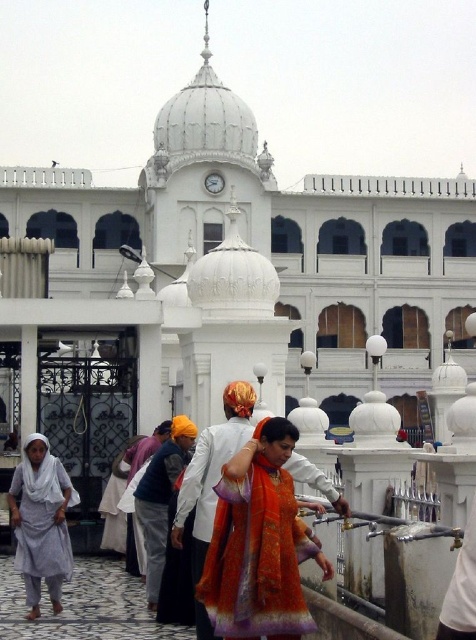
You are standing in front of the gurdwara and see a woman wearing a light gray cotton dress at lower left and another wearing an orange silk robe at center. Which woman is closer to you?

The light gray cotton dress at lower left is closer to you than the orange silk robe at center because it is further to the viewer.

You are an artist trying to sketch the scene. You notice two garments in the foreground. The light gray cotton dress at lower left and the orange silk robe at center. Which garment would appear more transparent when drawing them, based on their material thickness?

The light gray cotton dress at lower left is thinner than the orange silk robe at center, so it would appear more transparent in the sketch.

You are a photographer planning to capture a group photo of the people in the scene. You notice the orange silk saree at center and the light gray cotton dress at lower left. Which clothing item should you focus on first if you want to include both in the frame without zooming in or out?

The orange silk saree at center is bigger than the light gray cotton dress at lower left, so you should focus on the orange silk saree at center first to ensure it fits properly in the frame.